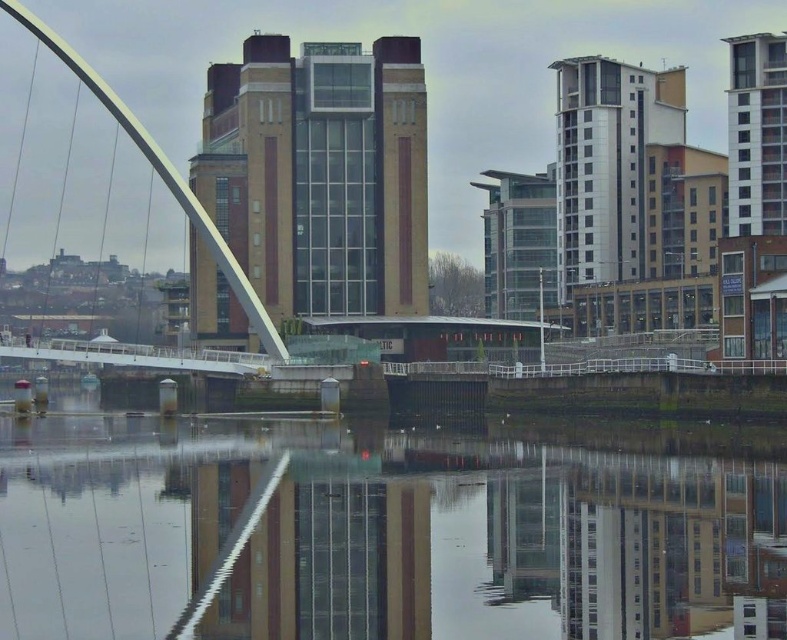
Question: Which object appears farthest from the camera in this image?

Choices:
 (A) transparent glass water at center
 (B) white glossy arch bridge at left

Answer: (B)

Question: Does transparent glass water at center lie behind white glossy arch bridge at left?

Choices:
 (A) no
 (B) yes

Answer: (A)

Question: Which point is farther from the camera taking this photo?

Choices:
 (A) (579, 605)
 (B) (54, 52)

Answer: (B)

Question: From the image, what is the correct spatial relationship of transparent glass water at center in relation to white glossy arch bridge at left?

Choices:
 (A) above
 (B) below

Answer: (B)

Question: Does transparent glass water at center have a greater width compared to white glossy arch bridge at left?

Choices:
 (A) yes
 (B) no

Answer: (A)